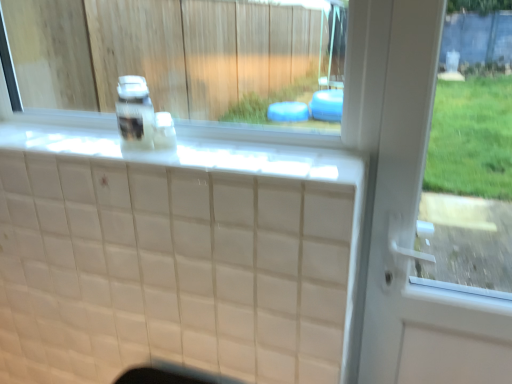
This screenshot has height=384, width=512. What are the coordinates of `white glossy window sill at upper center` in the screenshot? It's located at (180, 56).

What do you see at coordinates (135, 112) in the screenshot? I see `clear plastic bottle at center, which is counted as the 1th bottle, starting from the left` at bounding box center [135, 112].

The image size is (512, 384). What do you see at coordinates (191, 153) in the screenshot?
I see `white glossy ledge at upper center` at bounding box center [191, 153].

What is the approximate height of translucent plastic bottle at center, marked as the second bottle in a left-to-right arrangement?

translucent plastic bottle at center, marked as the second bottle in a left-to-right arrangement, is 4.64 inches tall.

At what (x,y) coordinates should I click in order to perform the action: click on white glossy window sill at upper center. Please return your answer as a coordinate pair (x, y). This screenshot has height=384, width=512. Looking at the image, I should click on (180, 56).

Based on the photo, is white glossy ledge at upper center wider than clear plastic bottle at center, which is counted as the 1th bottle, starting from the left?

Yes.

Looking at the image, does white glossy ledge at upper center seem bigger or smaller compared to clear plastic bottle at center, which is counted as the 1th bottle, starting from the left?

Considering their sizes, white glossy ledge at upper center takes up more space than clear plastic bottle at center, which is counted as the 1th bottle, starting from the left.

Considering the sizes of white glossy ledge at upper center and clear plastic bottle at center, which is counted as the 1th bottle, starting from the left, in the image, is white glossy ledge at upper center taller or shorter than clear plastic bottle at center, which is counted as the 1th bottle, starting from the left,?

white glossy ledge at upper center is shorter than clear plastic bottle at center, which is counted as the 1th bottle, starting from the left.

Which is nearer, (211, 167) or (131, 79)?

Positioned in front is point (211, 167).

I want to click on window above the white glossy ledge at upper center (from a real-world perspective), so click(180, 56).

Consider the image. From a real-world perspective, who is located higher, white glossy ledge at upper center or white glossy window sill at upper center?

white glossy window sill at upper center, from a real-world perspective.

Looking at this image, from the image's perspective, is white glossy ledge at upper center above white glossy window sill at upper center?

No, from the image's perspective, white glossy ledge at upper center is not above white glossy window sill at upper center.

Who is shorter, white glossy ledge at upper center or white glossy window sill at upper center?

white glossy ledge at upper center is shorter.

Measure the distance between white glossy window sill at upper center and clear plastic bottle at center, marked as the second bottle in a right-to-left arrangement.

10.38 feet.

Is white glossy window sill at upper center bigger than clear plastic bottle at center, marked as the second bottle in a right-to-left arrangement?

Correct, white glossy window sill at upper center is larger in size than clear plastic bottle at center, marked as the second bottle in a right-to-left arrangement.

Is point (73, 30) positioned behind point (130, 85)?

Yes, it is behind point (130, 85).

At what (x,y) coordinates should I click in order to perform the action: click on window located on the right of clear plastic bottle at center, which is counted as the 1th bottle, starting from the left. Please return your answer as a coordinate pair (x, y). This screenshot has width=512, height=384. Looking at the image, I should click on (180, 56).

Considering the sizes of clear plastic bottle at center, which is counted as the 1th bottle, starting from the left, and white glossy ledge at upper center in the image, is clear plastic bottle at center, which is counted as the 1th bottle, starting from the left, bigger or smaller than white glossy ledge at upper center?

Clearly, clear plastic bottle at center, which is counted as the 1th bottle, starting from the left, is smaller in size than white glossy ledge at upper center.

Could you tell me if clear plastic bottle at center, marked as the second bottle in a right-to-left arrangement, is turned towards white glossy ledge at upper center?

No, clear plastic bottle at center, marked as the second bottle in a right-to-left arrangement, is not aimed at white glossy ledge at upper center.

From the image's perspective, is clear plastic bottle at center, marked as the second bottle in a right-to-left arrangement, above or below white glossy ledge at upper center?

Based on their image positions, clear plastic bottle at center, marked as the second bottle in a right-to-left arrangement, is located above white glossy ledge at upper center.

Would you say clear plastic bottle at center, marked as the second bottle in a right-to-left arrangement, is outside white glossy ledge at upper center?

Yes, clear plastic bottle at center, marked as the second bottle in a right-to-left arrangement, is outside of white glossy ledge at upper center.

Based on the photo, does white glossy window sill at upper center lie behind white glossy ledge at upper center?

Yes, white glossy window sill at upper center is behind white glossy ledge at upper center.

What's the angular difference between white glossy window sill at upper center and white glossy ledge at upper center's facing directions?

0.183 degrees.

Is white glossy window sill at upper center outside of white glossy ledge at upper center?

Absolutely, white glossy window sill at upper center is external to white glossy ledge at upper center.

From the image's perspective, who appears lower, white glossy window sill at upper center or white glossy ledge at upper center?

white glossy ledge at upper center.

Where is `bottle above the translucent plastic bottle at center, acting as the first bottle starting from the right (from a real-world perspective)`? bottle above the translucent plastic bottle at center, acting as the first bottle starting from the right (from a real-world perspective) is located at coordinates (135, 112).

Based on their positions, is clear plastic bottle at center, which is counted as the 1th bottle, starting from the left, located to the left or right of translucent plastic bottle at center, marked as the second bottle in a left-to-right arrangement?

clear plastic bottle at center, which is counted as the 1th bottle, starting from the left, is to the left of translucent plastic bottle at center, marked as the second bottle in a left-to-right arrangement.

Would you say clear plastic bottle at center, which is counted as the 1th bottle, starting from the left, is inside or outside translucent plastic bottle at center, acting as the first bottle starting from the right?

clear plastic bottle at center, which is counted as the 1th bottle, starting from the left, is spatially situated outside translucent plastic bottle at center, acting as the first bottle starting from the right.

Does point (127, 143) lie in front of point (168, 114)?

Yes, it is.

Is point (156, 125) in front of point (201, 165)?

No, (156, 125) is behind (201, 165).

Identify the location of ledge that is in front of the translucent plastic bottle at center, acting as the first bottle starting from the right. This screenshot has width=512, height=384. click(191, 153).

From the picture: Does translucent plastic bottle at center, acting as the first bottle starting from the right, have a lesser height compared to white glossy ledge at upper center?

Incorrect, the height of translucent plastic bottle at center, acting as the first bottle starting from the right, does not fall short of that of white glossy ledge at upper center.

Is translucent plastic bottle at center, acting as the first bottle starting from the right, smaller than white glossy ledge at upper center?

Correct, translucent plastic bottle at center, acting as the first bottle starting from the right, occupies less space than white glossy ledge at upper center.

The height and width of the screenshot is (384, 512). Identify the location of ledge in front of the clear plastic bottle at center, which is counted as the 1th bottle, starting from the left. (191, 153).

Locate an element on the screen. This screenshot has height=384, width=512. ledge to the left of white glossy window sill at upper center is located at coordinates (191, 153).

When comparing their distances from white glossy window sill at upper center, does translucent plastic bottle at center, acting as the first bottle starting from the right, or clear plastic bottle at center, which is counted as the 1th bottle, starting from the left, seem closer?

Based on the image, clear plastic bottle at center, which is counted as the 1th bottle, starting from the left, appears to be nearer to white glossy window sill at upper center.

Considering their positions, is white glossy window sill at upper center positioned further to translucent plastic bottle at center, acting as the first bottle starting from the right, than clear plastic bottle at center, marked as the second bottle in a right-to-left arrangement?

Among the two, white glossy window sill at upper center is located further to translucent plastic bottle at center, acting as the first bottle starting from the right.

Which object lies further to the anchor point translucent plastic bottle at center, acting as the first bottle starting from the right, clear plastic bottle at center, marked as the second bottle in a right-to-left arrangement, or white glossy window sill at upper center?

white glossy window sill at upper center is positioned further to the anchor translucent plastic bottle at center, acting as the first bottle starting from the right.

From the image, which object appears to be farther from white glossy ledge at upper center, clear plastic bottle at center, marked as the second bottle in a right-to-left arrangement, or white glossy window sill at upper center?

white glossy window sill at upper center is positioned further to the anchor white glossy ledge at upper center.

Based on the photo, based on their spatial positions, is translucent plastic bottle at center, acting as the first bottle starting from the right, or white glossy ledge at upper center closer to clear plastic bottle at center, which is counted as the 1th bottle, starting from the left?

translucent plastic bottle at center, acting as the first bottle starting from the right, lies closer to clear plastic bottle at center, which is counted as the 1th bottle, starting from the left, than the other object.

Based on the photo, looking at the image, which one is located closer to translucent plastic bottle at center, acting as the first bottle starting from the right, clear plastic bottle at center, which is counted as the 1th bottle, starting from the left, or white glossy ledge at upper center?

Based on the image, clear plastic bottle at center, which is counted as the 1th bottle, starting from the left, appears to be nearer to translucent plastic bottle at center, acting as the first bottle starting from the right.

Looking at the image, which one is located further to clear plastic bottle at center, which is counted as the 1th bottle, starting from the left, translucent plastic bottle at center, marked as the second bottle in a left-to-right arrangement, or white glossy window sill at upper center?

white glossy window sill at upper center lies further to clear plastic bottle at center, which is counted as the 1th bottle, starting from the left, than the other object.

Looking at the image, which one is located further to white glossy ledge at upper center, translucent plastic bottle at center, acting as the first bottle starting from the right, or clear plastic bottle at center, marked as the second bottle in a right-to-left arrangement?

The object further to white glossy ledge at upper center is translucent plastic bottle at center, acting as the first bottle starting from the right.

This screenshot has height=384, width=512. Identify the location of bottle between white glossy ledge at upper center and translucent plastic bottle at center, acting as the first bottle starting from the right, along the z-axis. (135, 112).

Identify the location of bottle between white glossy window sill at upper center and translucent plastic bottle at center, acting as the first bottle starting from the right, in the front-back direction. (135, 112).